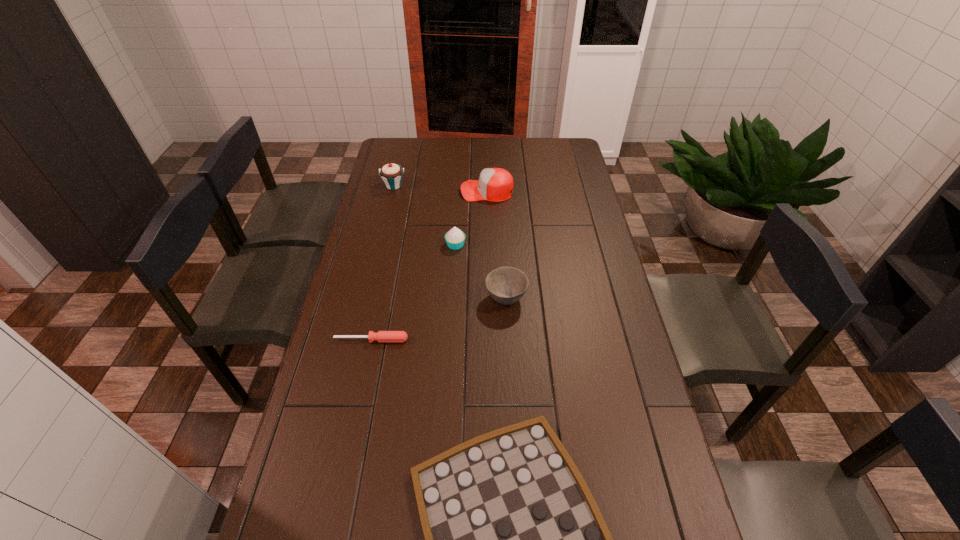
This screenshot has width=960, height=540. I want to click on vacant space in between the right cupcake and the screwdriver, so click(x=414, y=292).

Locate an element on the screen. This screenshot has width=960, height=540. unoccupied area between the baseball cap and the right cupcake is located at coordinates (471, 218).

The height and width of the screenshot is (540, 960). I want to click on blank region between the fourth farthest object and the fifth farthest object, so click(439, 319).

Locate an element on the screen. The height and width of the screenshot is (540, 960). free space between the right cupcake and the baseball cap is located at coordinates coord(471,218).

Image resolution: width=960 pixels, height=540 pixels. In order to click on blank region between the baseball cap and the second shortest object in this screenshot , I will do `click(429, 265)`.

At what (x,y) coordinates should I click in order to perform the action: click on free spot between the bowl and the fifth tallest object. Please return your answer as a coordinate pair (x, y). The width and height of the screenshot is (960, 540). Looking at the image, I should click on (439, 319).

Identify which object is the fourth closest to the fifth tallest object. Please provide its 2D coordinates. Your answer should be formatted as a tuple, i.e. [(x, y)], where the tuple contains the x and y coordinates of a point satisfying the conditions above.

[(495, 184)]

Point out which object is positioned as the third nearest to the taller cupcake. Please provide its 2D coordinates. Your answer should be formatted as a tuple, i.e. [(x, y)], where the tuple contains the x and y coordinates of a point satisfying the conditions above.

[(506, 285)]

Find the location of a particular element. The width and height of the screenshot is (960, 540). free location that satisfies the following two spatial constraints: 1. on the front-facing side of the baseball cap; 2. on the left side of the fourth farthest object is located at coordinates (489, 298).

Locate an element on the screen. free location that satisfies the following two spatial constraints: 1. on the front-facing side of the baseball cap; 2. on the left side of the bowl is located at coordinates (489, 298).